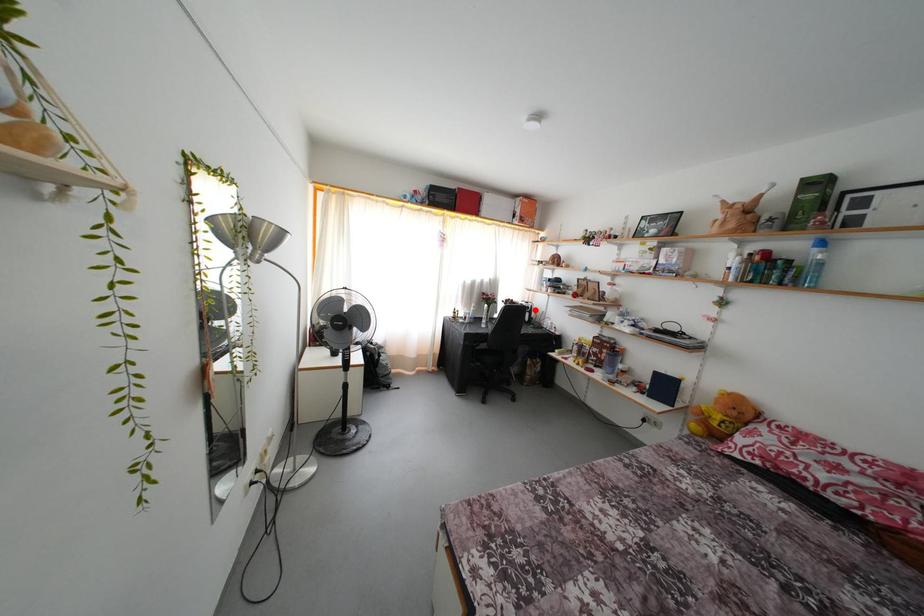
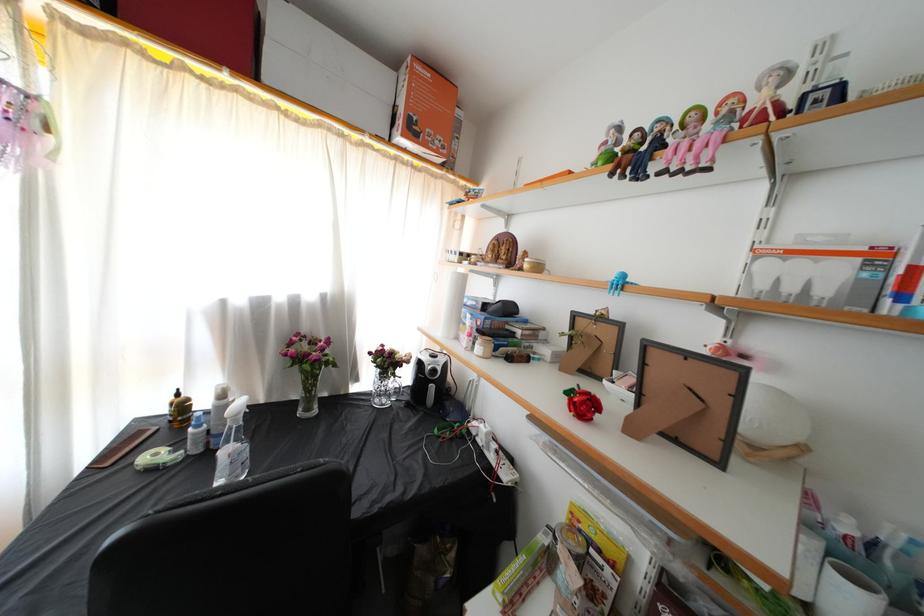
Question: A red point is marked in image1. In image2, is the corresponding 3D point closer to the camera or farther? Reply with the corresponding letter.

Choices:
 (A) The corresponding 3D point is closer.
 (B) The corresponding 3D point is farther.

Answer: (B)